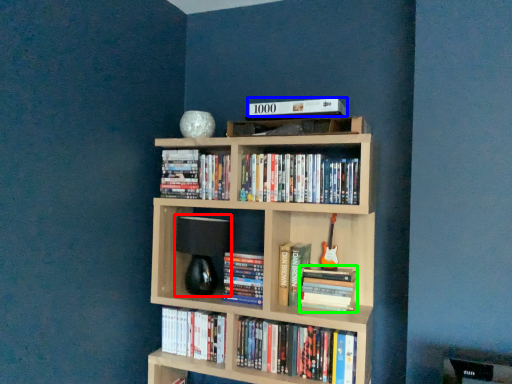
Question: Based on their relative distances, which object is farther from lamp (highlighted by a red box)? Choose from book (highlighted by a blue box) and book (highlighted by a green box).

Choices:
 (A) book
 (B) book

Answer: (A)